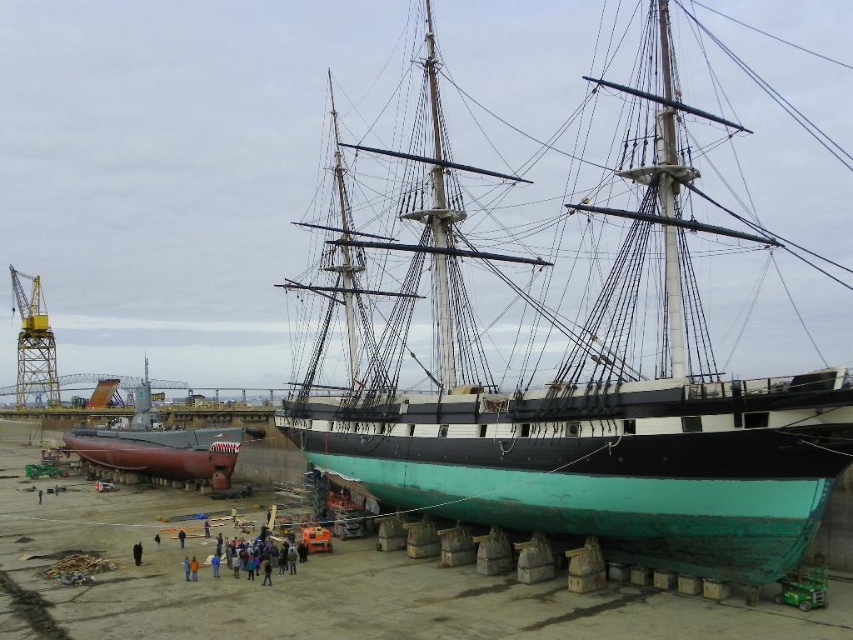
Can you confirm if matte red submarine at lower left is positioned below dark blue jeans at lower center?

Actually, matte red submarine at lower left is above dark blue jeans at lower center.

Does matte red submarine at lower left lie behind dark blue jeans at lower center?

Yes, matte red submarine at lower left is further from the viewer.

Does point (143, 417) come in front of point (135, 556)?

No, (143, 417) is further to viewer.

Where is `matte red submarine at lower left`? This screenshot has height=640, width=853. matte red submarine at lower left is located at coordinates (160, 445).

Can you confirm if yellow painted metal crane at left is positioned to the left of dark blue jeans at lower center?

Correct, you'll find yellow painted metal crane at left to the left of dark blue jeans at lower center.

Is yellow painted metal crane at left wider than dark blue jeans at lower center?

Correct, the width of yellow painted metal crane at left exceeds that of dark blue jeans at lower center.

Is point (36, 358) more distant than point (136, 561)?

Yes, it is.

The image size is (853, 640). Identify the location of yellow painted metal crane at left. (33, 344).

Does teal matte ship at center appear over dark blue fabric at lower center?

Correct, teal matte ship at center is located above dark blue fabric at lower center.

Who is positioned more to the left, teal matte ship at center or dark blue fabric at lower center?

dark blue fabric at lower center

Identify the location of teal matte ship at center. (572, 380).

Identify the location of teal matte ship at center. (572, 380).